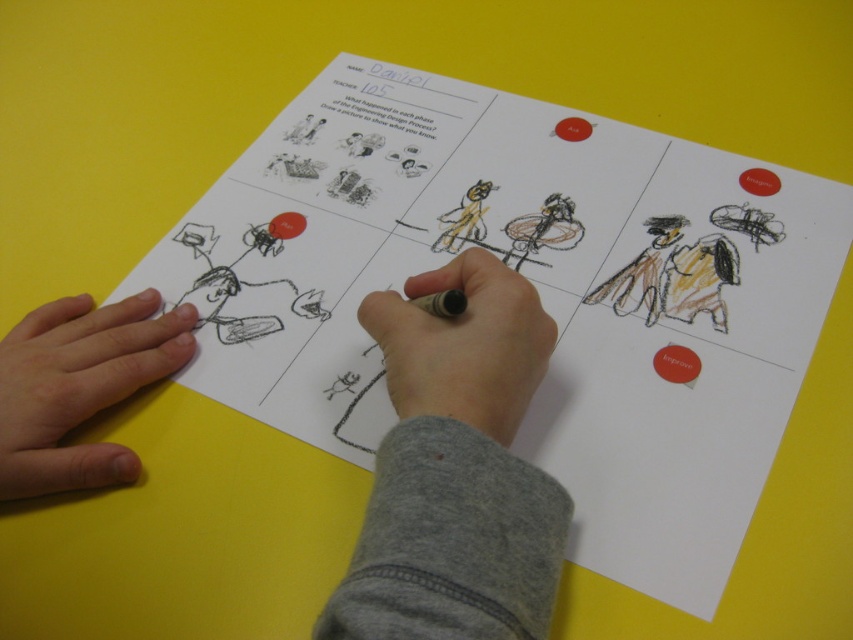
Is point (33, 438) behind point (508, 276)?

No, (33, 438) is closer to viewer.

Does skinny flesh at left appear over gray felt-tip pen at center?

Incorrect, skinny flesh at left is not positioned above gray felt-tip pen at center.

This screenshot has height=640, width=853. Find the location of `skinny flesh at left`. skinny flesh at left is located at coordinates pyautogui.click(x=79, y=387).

In the scene shown: Can you confirm if gray fabric hand at center is bigger than matte black pencil at center?

Indeed, gray fabric hand at center has a larger size compared to matte black pencil at center.

Is gray fabric hand at center to the right of matte black pencil at center from the viewer's perspective?

Incorrect, gray fabric hand at center is not on the right side of matte black pencil at center.

Who is more forward, (x=39, y=476) or (x=427, y=298)?

Point (x=39, y=476) is more forward.

You are a GUI agent. You are given a task and a screenshot of the screen. Output one action in this format:
    pyautogui.click(x=<x>, y=<y>)
    Task: Click on the gray fabric hand at center
    This screenshot has width=853, height=640.
    Given the screenshot: What is the action you would take?
    pyautogui.click(x=456, y=470)

Consider the image. Is skinny flesh at left taller than matte black pencil at center?

Indeed, skinny flesh at left has a greater height compared to matte black pencil at center.

Is skinny flesh at left thinner than matte black pencil at center?

Incorrect, skinny flesh at left's width is not less than matte black pencil at center's.

Locate an element on the screen. skinny flesh at left is located at coordinates (79, 387).

You are a GUI agent. You are given a task and a screenshot of the screen. Output one action in this format:
    pyautogui.click(x=<x>, y=<y>)
    Task: Click on the skinny flesh at left
    
    Given the screenshot: What is the action you would take?
    pyautogui.click(x=79, y=387)